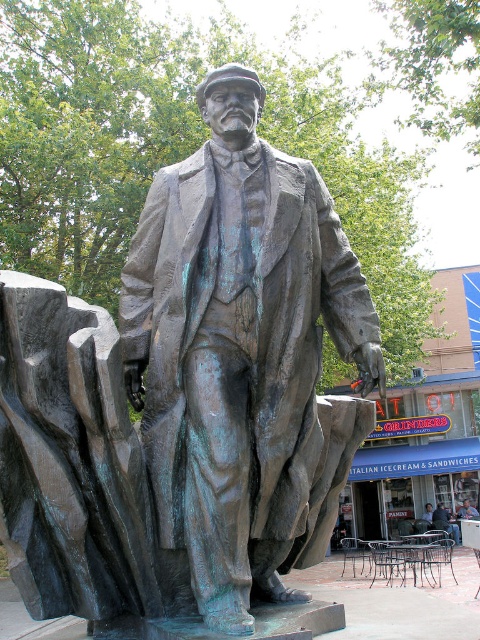
Does bronze statue at center lie behind matte bronze statue at center?

That is False.

Does bronze statue at center appear over matte bronze statue at center?

Yes.

The height and width of the screenshot is (640, 480). In order to click on bronze statue at center in this screenshot , I will do `click(243, 356)`.

What are the coordinates of `bronze statue at center` in the screenshot? It's located at (243, 356).